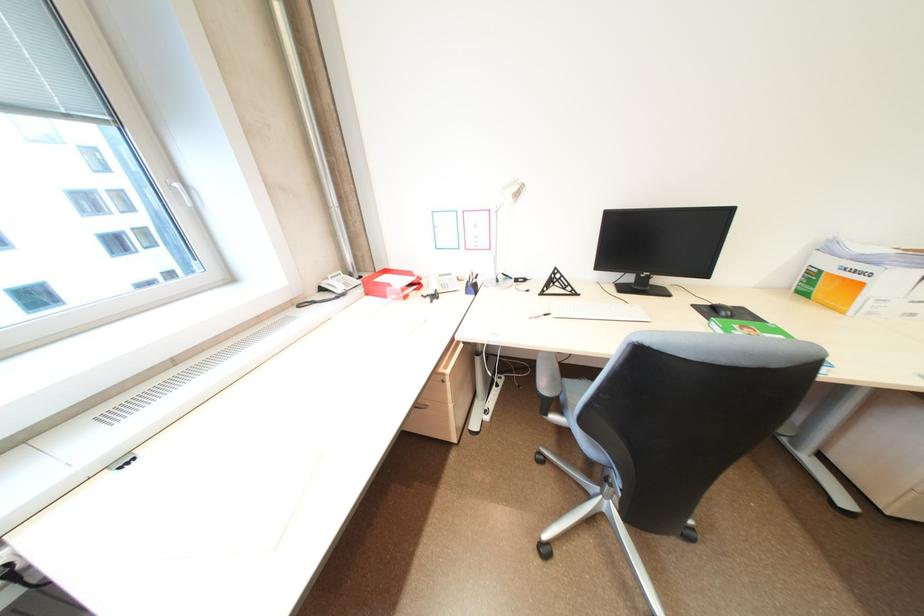
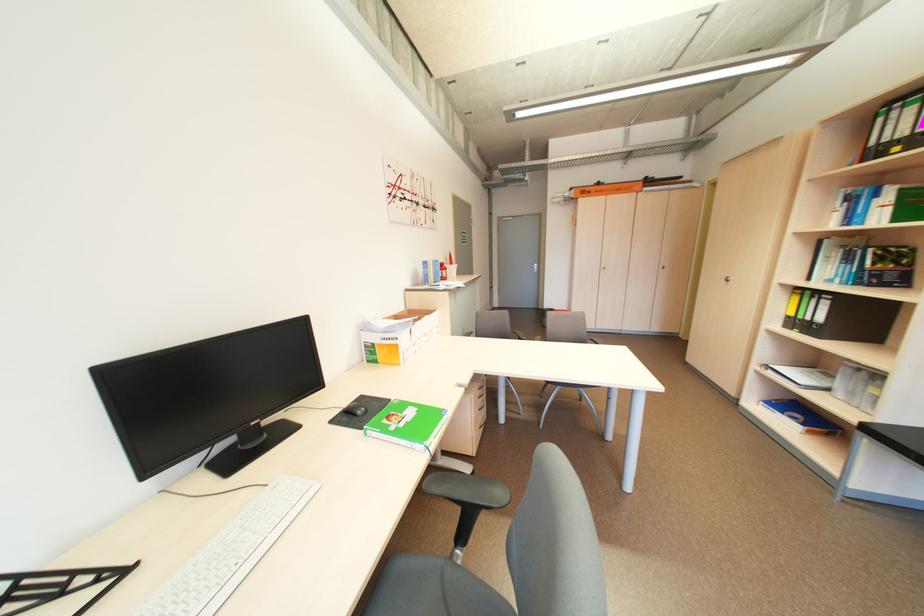
Locate, in the second image, the point that corresponds to the point at 725,302 in the first image.

(354, 406)